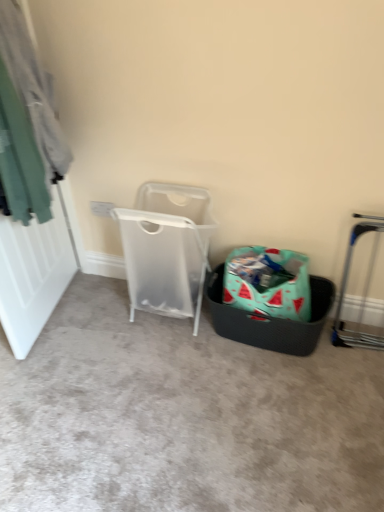
Question: Does transparent plastic laundry basket at center have a larger size compared to teal fabric at left?

Choices:
 (A) no
 (B) yes

Answer: (A)

Question: From the image's perspective, is transparent plastic laundry basket at center below teal fabric at left?

Choices:
 (A) yes
 (B) no

Answer: (A)

Question: Is transparent plastic laundry basket at center positioned far away from teal fabric at left?

Choices:
 (A) yes
 (B) no

Answer: (B)

Question: Is transparent plastic laundry basket at center next to teal fabric at left?

Choices:
 (A) yes
 (B) no

Answer: (B)

Question: Is transparent plastic laundry basket at center oriented towards teal fabric at left?

Choices:
 (A) no
 (B) yes

Answer: (A)

Question: Considering their positions, is silver metallic trolley at right located in front of or behind transparent plastic laundry basket at center?

Choices:
 (A) behind
 (B) front

Answer: (B)

Question: Considering the positions of silver metallic trolley at right and transparent plastic laundry basket at center in the image, is silver metallic trolley at right taller or shorter than transparent plastic laundry basket at center?

Choices:
 (A) tall
 (B) short

Answer: (B)

Question: Is silver metallic trolley at right to the left or to the right of transparent plastic laundry basket at center in the image?

Choices:
 (A) right
 (B) left

Answer: (A)

Question: From the image's perspective, is silver metallic trolley at right positioned above or below transparent plastic laundry basket at center?

Choices:
 (A) below
 (B) above

Answer: (A)

Question: Is silver metallic trolley at right spatially inside watermelon-patterned fabric shopping bag at center, or outside of it?

Choices:
 (A) inside
 (B) outside

Answer: (B)

Question: From a real-world perspective, relative to watermelon-patterned fabric shopping bag at center, is silver metallic trolley at right vertically above or below?

Choices:
 (A) above
 (B) below

Answer: (A)

Question: Looking at their shapes, would you say silver metallic trolley at right is wider or thinner than watermelon-patterned fabric shopping bag at center?

Choices:
 (A) thin
 (B) wide

Answer: (A)

Question: Relative to watermelon-patterned fabric shopping bag at center, is silver metallic trolley at right in front or behind?

Choices:
 (A) front
 (B) behind

Answer: (A)

Question: Considering the positions of teal fabric at left and silver metallic trolley at right in the image, is teal fabric at left bigger or smaller than silver metallic trolley at right?

Choices:
 (A) small
 (B) big

Answer: (B)

Question: In terms of width, does teal fabric at left look wider or thinner when compared to silver metallic trolley at right?

Choices:
 (A) wide
 (B) thin

Answer: (A)